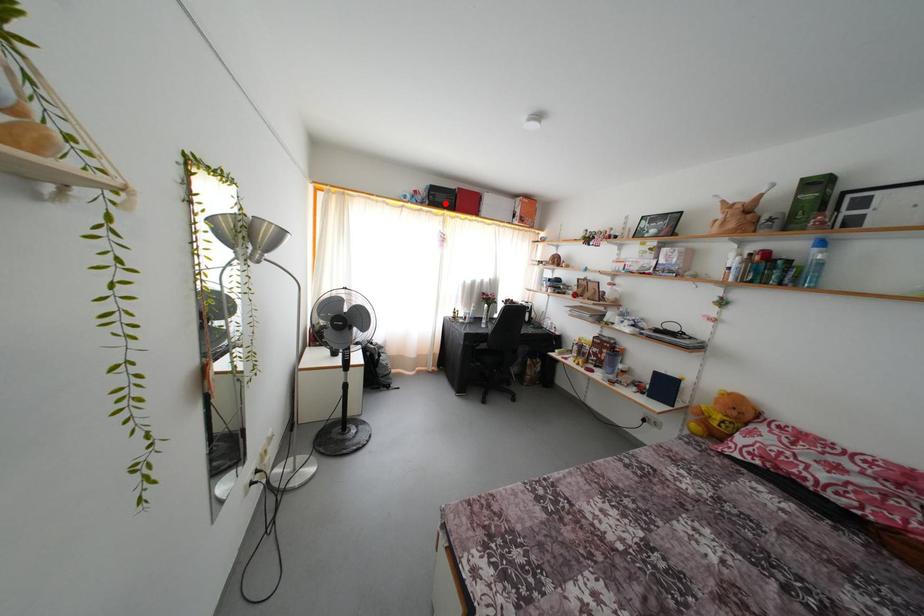
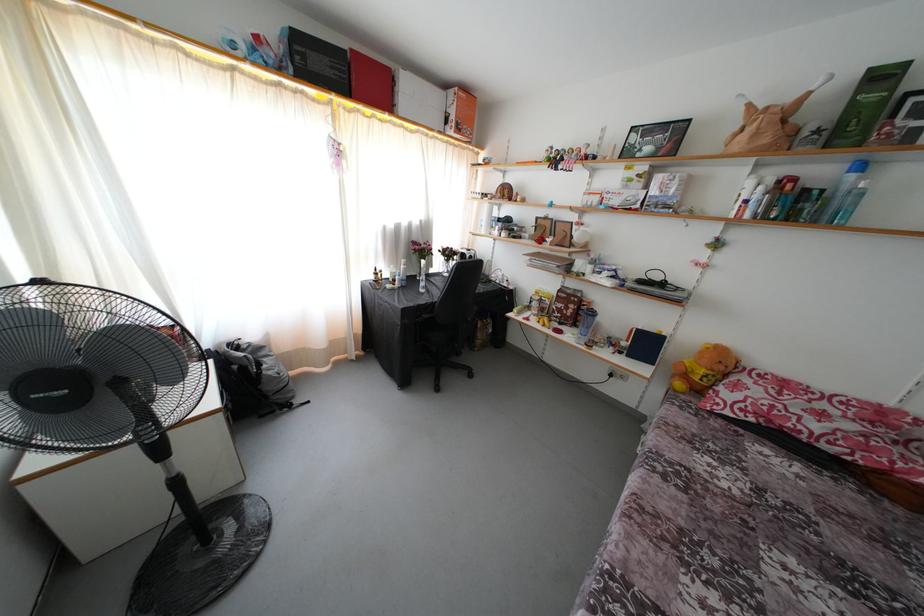
Question: I am providing you with two images of the same scene from different viewpoints. Given a red point in image1, look at the same physical point in image2. Is it:

Choices:
 (A) Closer to the viewpoint
 (B) Farther from the viewpoint

Answer: (B)